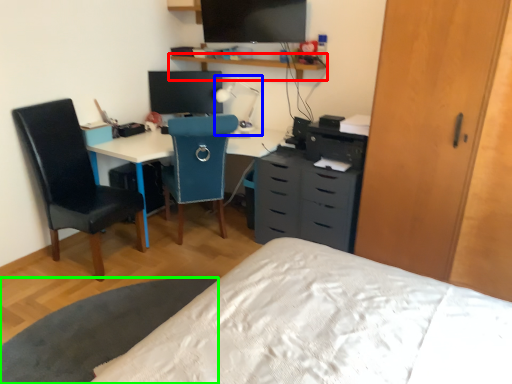
Question: Estimate the real-world distances between objects in this image. Which object is farther from shelf (highlighted by a red box), table lamp (highlighted by a blue box) or table (highlighted by a green box)?

Choices:
 (A) table lamp
 (B) table

Answer: (B)